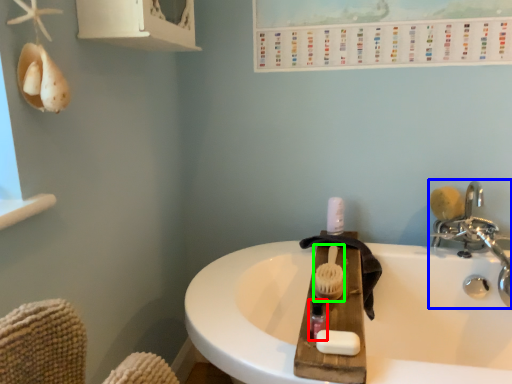
Question: Which is farther away from mouthwash (highlighted by a red box)? tap (highlighted by a blue box) or brush (highlighted by a green box)?

Choices:
 (A) tap
 (B) brush

Answer: (A)